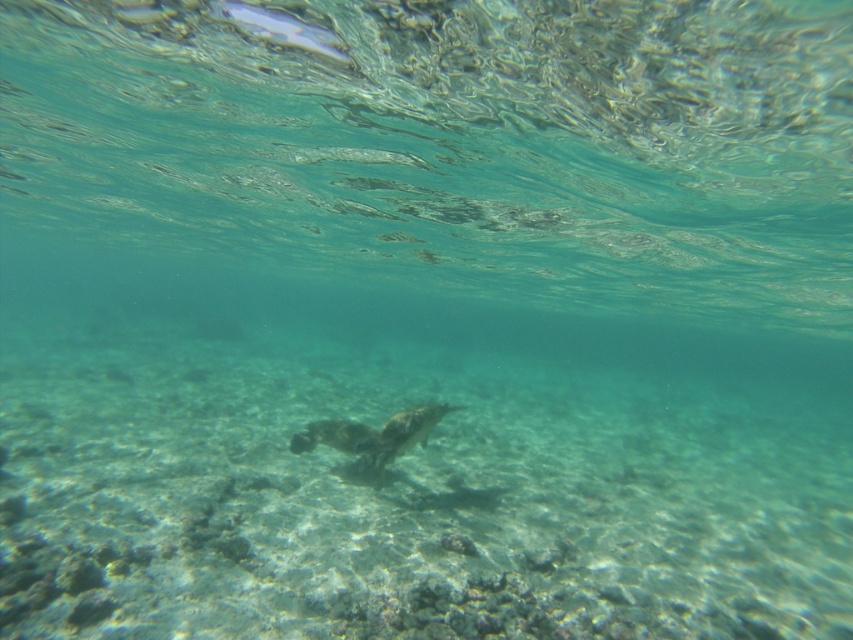
Question: Is camouflage-patterned fish at center behind translucent glassy fish at upper center?

Choices:
 (A) yes
 (B) no

Answer: (A)

Question: Which point is farther to the camera?

Choices:
 (A) (345, 451)
 (B) (293, 24)

Answer: (A)

Question: Can you confirm if camouflage-patterned fish at center is smaller than translucent glassy fish at upper center?

Choices:
 (A) yes
 (B) no

Answer: (B)

Question: Which point is farther from the camera taking this photo?

Choices:
 (A) (364, 444)
 (B) (258, 26)

Answer: (A)

Question: Can you confirm if camouflage-patterned fish at center is positioned to the right of translucent glassy fish at upper center?

Choices:
 (A) no
 (B) yes

Answer: (B)

Question: Which point is farther to the camera?

Choices:
 (A) translucent glassy fish at upper center
 (B) camouflage-patterned fish at center

Answer: (B)